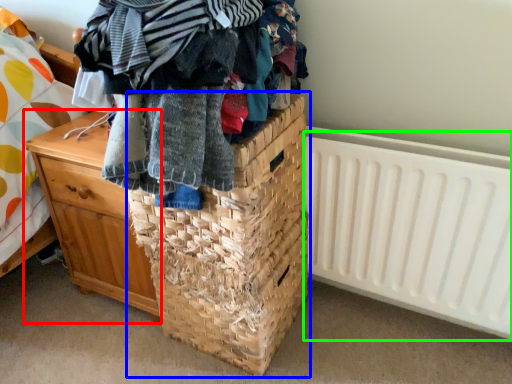
Question: Which object is positioned farthest from chest of drawers (highlighted by a red box)? Select from basket (highlighted by a blue box) and radiator (highlighted by a green box).

Choices:
 (A) basket
 (B) radiator

Answer: (B)